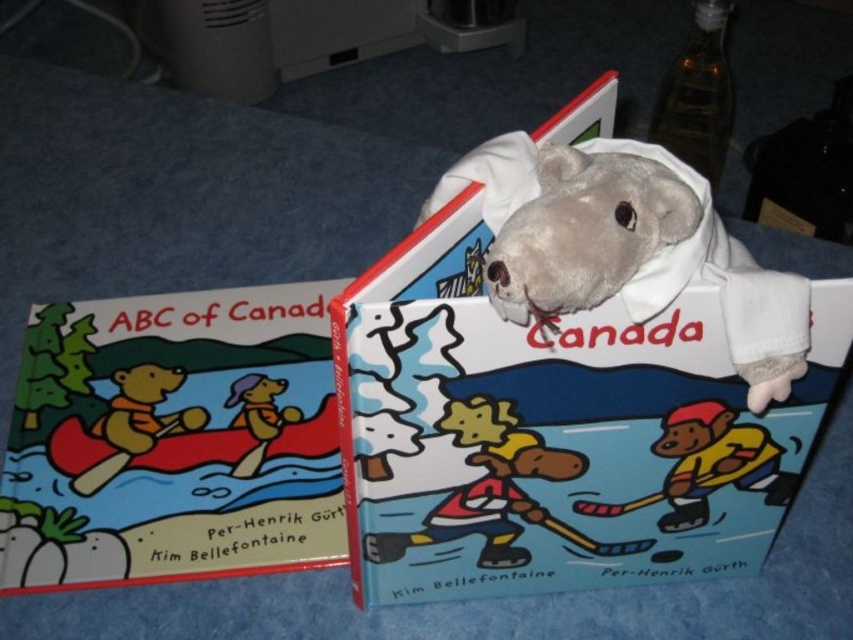
Can you confirm if gray plush toy at center is positioned to the left of matte plastic hockey player at center?

Yes, gray plush toy at center is to the left of matte plastic hockey player at center.

Looking at this image, which is above, gray plush toy at center or matte plastic hockey player at center?

gray plush toy at center

The width and height of the screenshot is (853, 640). What are the coordinates of `gray plush toy at center` in the screenshot? It's located at (636, 250).

Is point (425, 509) positioned behind point (132, 492)?

No, (425, 509) is closer to viewer.

Find the location of `white soft plush at upper center`. white soft plush at upper center is located at coordinates (553, 433).

Who is positioned more to the left, matte paper book at left or matte plastic hockey player at center?

matte paper book at left

Between matte paper book at left and matte plastic hockey player at center, which one has less height?

With less height is matte plastic hockey player at center.

Who is more forward, (53, 412) or (753, 426)?

Point (753, 426) is in front.

The image size is (853, 640). Find the location of `matte paper book at left`. matte paper book at left is located at coordinates (172, 440).